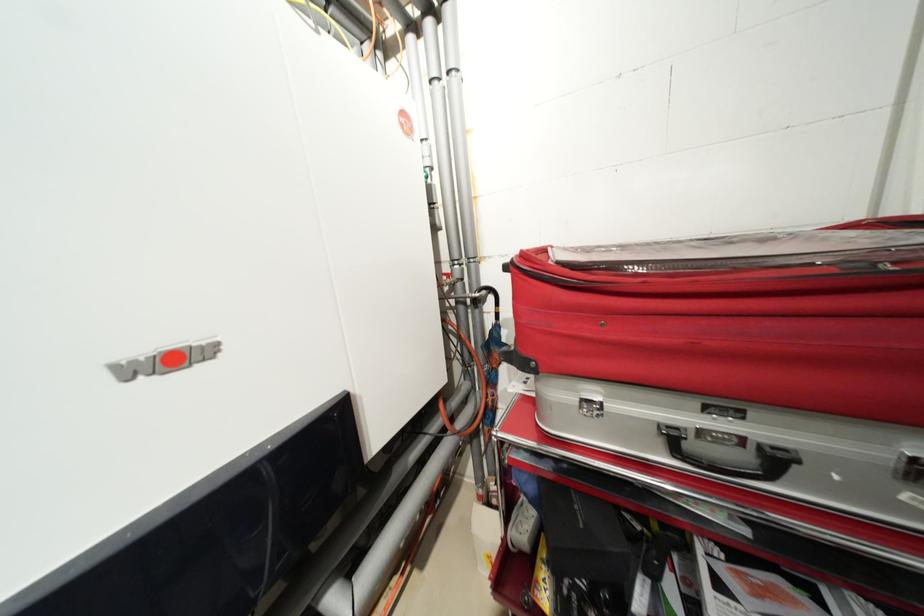
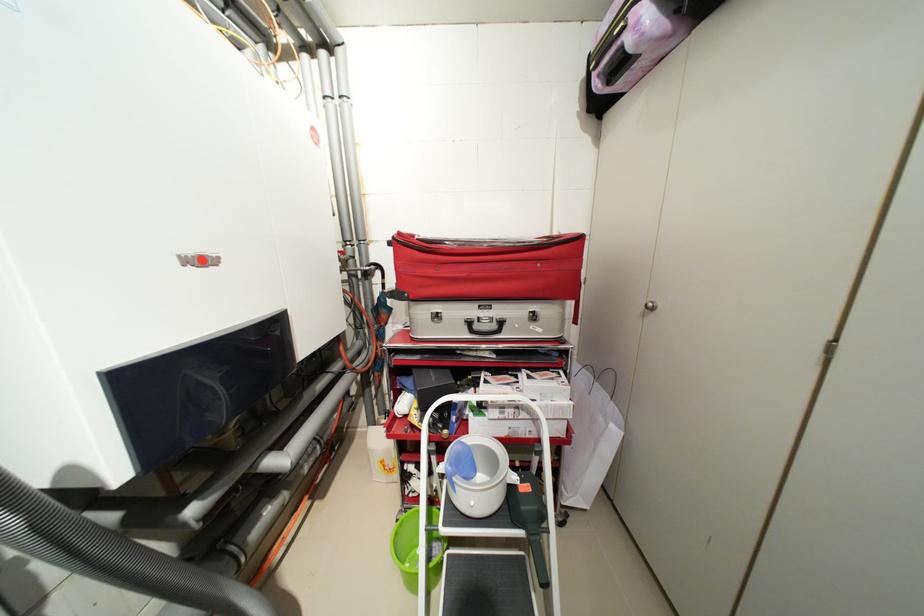
In the second image, find the point that corresponds to (530,256) in the first image.

(407, 235)